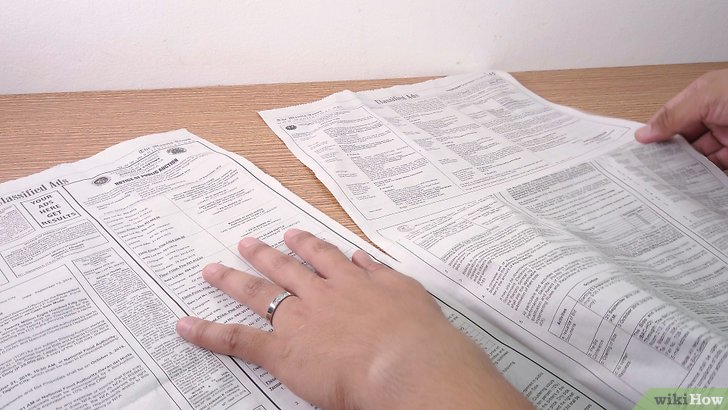
You are a GUI agent. You are given a task and a screenshot of the screen. Output one action in this format:
    pyautogui.click(x=<x>, y=<y>)
    Task: Click on the wall
    The width and height of the screenshot is (728, 410).
    Given the screenshot: What is the action you would take?
    pyautogui.click(x=582, y=27)